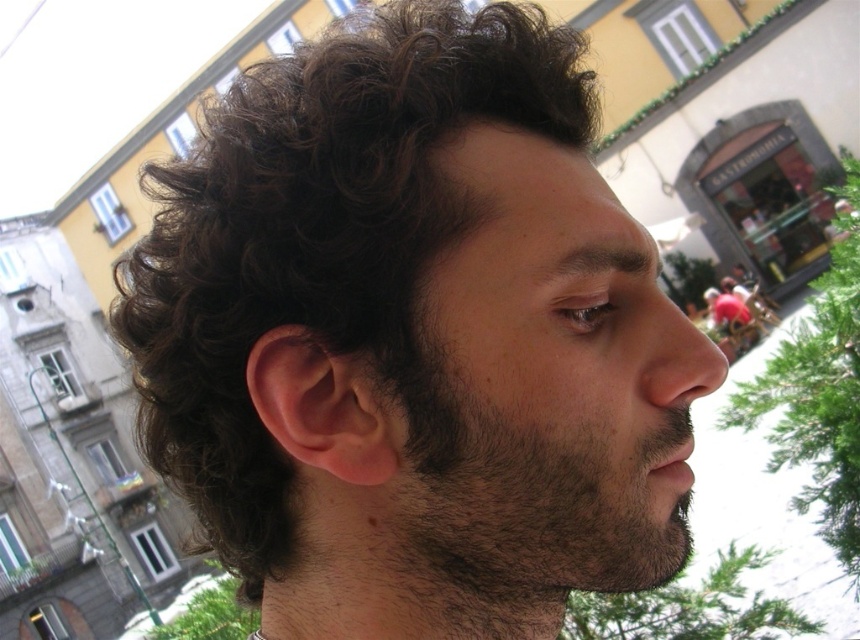
Can you confirm if dark brown fuzzy beard at center is positioned to the right of brown hairy mouth at lower center?

No, dark brown fuzzy beard at center is not to the right of brown hairy mouth at lower center.

Does dark brown fuzzy beard at center have a smaller size compared to brown hairy mouth at lower center?

Incorrect, dark brown fuzzy beard at center is not smaller in size than brown hairy mouth at lower center.

Locate an element on the screen. The width and height of the screenshot is (860, 640). dark brown fuzzy beard at center is located at coordinates (521, 483).

Between dark brown curly hair at center and dark brown fuzzy beard at center, which one appears on the right side from the viewer's perspective?

From the viewer's perspective, dark brown fuzzy beard at center appears more on the right side.

This screenshot has width=860, height=640. What do you see at coordinates (320, 243) in the screenshot? I see `dark brown curly hair at center` at bounding box center [320, 243].

Identify the location of dark brown curly hair at center. This screenshot has width=860, height=640. (320, 243).

Consider the image. Measure the distance between dark brown curly hair at center and camera.

4.56 meters

Does dark brown curly hair at center have a lesser width compared to brown hairy mouth at lower center?

No, dark brown curly hair at center is not thinner than brown hairy mouth at lower center.

Is point (441, 22) positioned after point (673, 451)?

Yes, it is.

This screenshot has height=640, width=860. I want to click on dark brown curly hair at center, so click(320, 243).